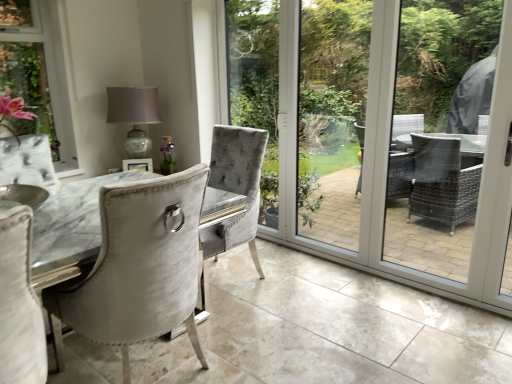
Question: In the image, is satin white chair at center positioned in front of or behind clear glass screen door at center, the second screen door viewed from the right?

Choices:
 (A) front
 (B) behind

Answer: (A)

Question: Is satin white chair at center inside the boundaries of clear glass screen door at center, the 1th screen door viewed from the left, or outside?

Choices:
 (A) outside
 (B) inside

Answer: (A)

Question: Which is nearer to the satin white chair at center?

Choices:
 (A) clear glass screen door at center, the 1th screen door viewed from the left
 (B) matte glass table lamp at upper center
 (C) white glossy screen door at right, which ranks as the 1th screen door in right-to-left order

Answer: (C)

Question: Estimate the real-world distances between objects in this image. Which object is closer to the matte glass table lamp at upper center?

Choices:
 (A) satin white chair at center
 (B) white glossy screen door at right, which is the second screen door in left-to-right order
 (C) clear glass screen door at center, the 1th screen door viewed from the left

Answer: (A)